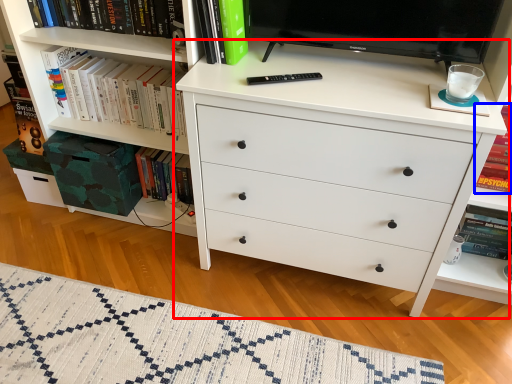
Question: Which object is further to the camera taking this photo, chest of drawers (highlighted by a red box) or book (highlighted by a blue box)?

Choices:
 (A) chest of drawers
 (B) book

Answer: (B)